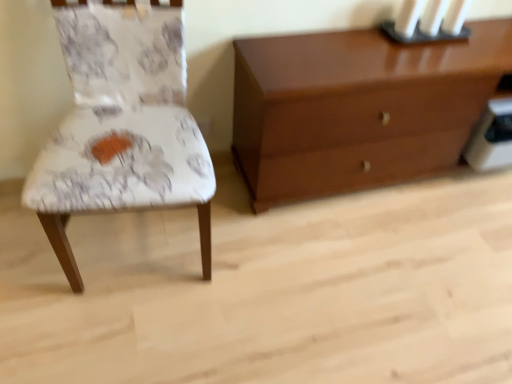
Question: Could you tell me if black matte candle holder at upper right is facing white fabric chair at left?

Choices:
 (A) yes
 (B) no

Answer: (B)

Question: Does black matte candle holder at upper right appear on the left side of white fabric chair at left?

Choices:
 (A) no
 (B) yes

Answer: (A)

Question: Considering the relative sizes of black matte candle holder at upper right and white fabric chair at left in the image provided, is black matte candle holder at upper right taller than white fabric chair at left?

Choices:
 (A) no
 (B) yes

Answer: (A)

Question: Can you confirm if black matte candle holder at upper right is bigger than white fabric chair at left?

Choices:
 (A) no
 (B) yes

Answer: (A)

Question: Considering the relative sizes of black matte candle holder at upper right and white fabric chair at left in the image provided, is black matte candle holder at upper right thinner than white fabric chair at left?

Choices:
 (A) yes
 (B) no

Answer: (A)

Question: From a real-world perspective, is black matte candle holder at upper right physically above white fabric chair at left?

Choices:
 (A) yes
 (B) no

Answer: (A)

Question: From the image's perspective, is glossy wood chest of drawers at upper right over white fabric chair at left?

Choices:
 (A) no
 (B) yes

Answer: (B)

Question: From a real-world perspective, is glossy wood chest of drawers at upper right under white fabric chair at left?

Choices:
 (A) no
 (B) yes

Answer: (B)

Question: Is glossy wood chest of drawers at upper right wider than white fabric chair at left?

Choices:
 (A) no
 (B) yes

Answer: (A)

Question: Is glossy wood chest of drawers at upper right smaller than white fabric chair at left?

Choices:
 (A) yes
 (B) no

Answer: (B)

Question: Is glossy wood chest of drawers at upper right facing towards white fabric chair at left?

Choices:
 (A) yes
 (B) no

Answer: (B)

Question: Are glossy wood chest of drawers at upper right and white fabric chair at left beside each other?

Choices:
 (A) yes
 (B) no

Answer: (B)

Question: Is glossy wood chest of drawers at upper right closer to the viewer compared to black matte candle holder at upper right?

Choices:
 (A) no
 (B) yes

Answer: (B)